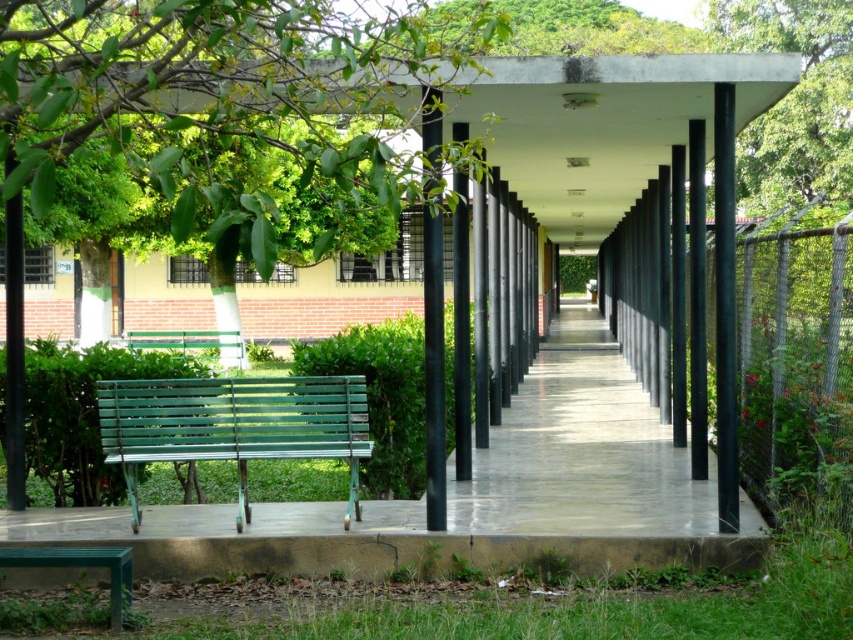
Which of these two, green leafy tree at upper left or concrete at center, stands shorter?

concrete at center is shorter.

Which is more to the left, green leafy tree at upper left or concrete at center?

From the viewer's perspective, green leafy tree at upper left appears more on the left side.

Where is `green leafy tree at upper left`? This screenshot has height=640, width=853. green leafy tree at upper left is located at coordinates (223, 122).

Can you confirm if concrete at center is positioned to the right of chain-link fence at right?

No, concrete at center is not to the right of chain-link fence at right.

Looking at this image, who is more forward, (538, 512) or (824, 337)?

Point (824, 337)

Is point (553, 412) positioned before point (815, 298)?

No, (553, 412) is further to viewer.

At what (x,y) coordinates should I click in order to perform the action: click on concrete at center. Please return your answer as a coordinate pair (x, y). This screenshot has height=640, width=853. Looking at the image, I should click on (581, 451).

Does point (113, 156) lie behind point (136, 426)?

Yes, it is behind point (136, 426).

Does point (341, 218) come in front of point (131, 516)?

Yes, it is in front of point (131, 516).

The height and width of the screenshot is (640, 853). Identify the location of green leafy tree at upper left. 223,122.